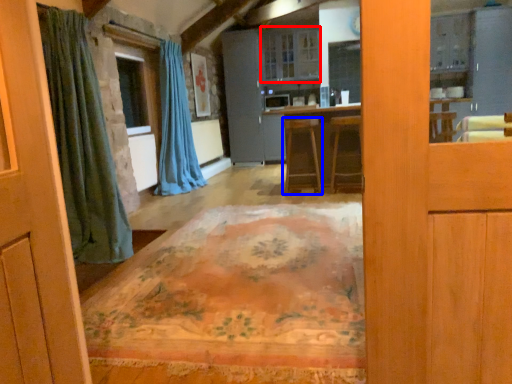
Question: Which of the following is the closest to the observer, cabinetry (highlighted by a red box) or furniture (highlighted by a blue box)?

Choices:
 (A) cabinetry
 (B) furniture

Answer: (B)